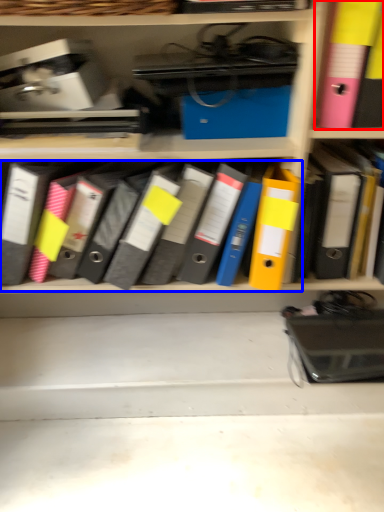
Question: Which of the following is the closest to the observer, bin (highlighted by a red box) or notebook (highlighted by a blue box)?

Choices:
 (A) bin
 (B) notebook

Answer: (A)